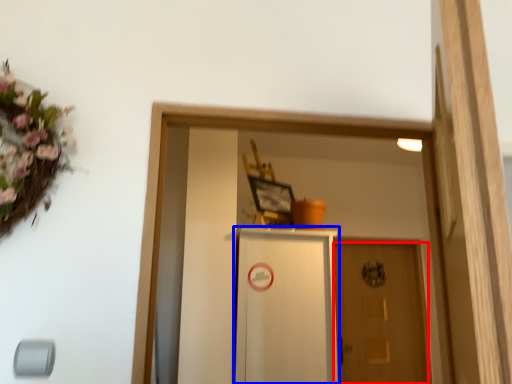
Question: Which object is closer to the camera taking this photo, door (highlighted by a red box) or cabinetry (highlighted by a blue box)?

Choices:
 (A) door
 (B) cabinetry

Answer: (B)